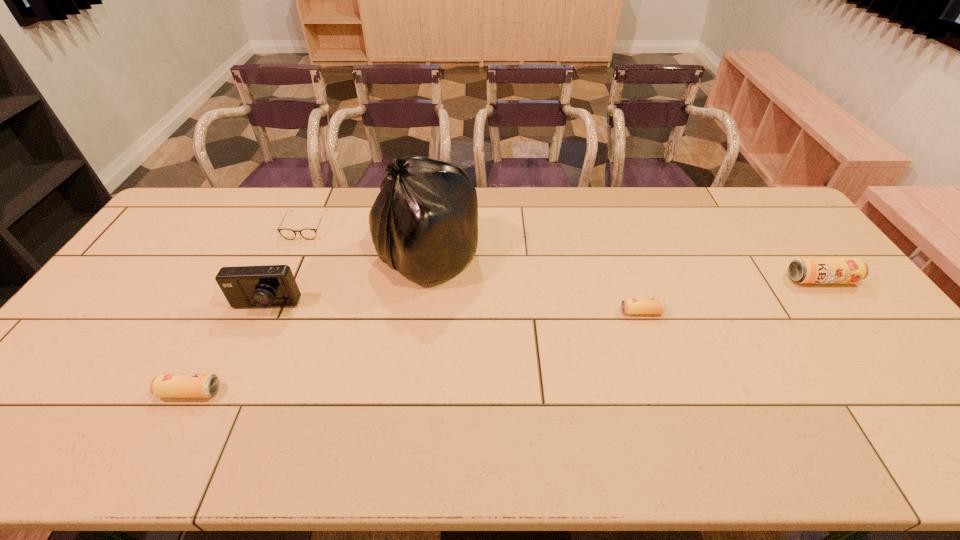
Locate an element on the screen. The width and height of the screenshot is (960, 540). free area in between the spectacles and the third tallest object is located at coordinates (564, 253).

At what (x,y) coordinates should I click in order to perform the action: click on empty location between the shortest beer can and the nearest beer can. Please return your answer as a coordinate pair (x, y). Image resolution: width=960 pixels, height=540 pixels. Looking at the image, I should click on (416, 352).

The image size is (960, 540). I want to click on object that can be found as the third closest to the rightmost beer can, so click(265, 286).

I want to click on object that stands as the second closest to the rightmost object, so click(x=424, y=222).

Select which beer can is the closest to the second nearest beer can. Please provide its 2D coordinates. Your answer should be formatted as a tuple, i.e. [(x, y)], where the tuple contains the x and y coordinates of a point satisfying the conditions above.

[(801, 270)]

Choose which beer can is the nearest neighbor to the second beer can from left to right. Please provide its 2D coordinates. Your answer should be formatted as a tuple, i.e. [(x, y)], where the tuple contains the x and y coordinates of a point satisfying the conditions above.

[(801, 270)]

Find the location of `blank area in the image that satisfies the following two spatial constraints: 1. through the lenses of the tallest object; 2. on the right side of the spectacles`. blank area in the image that satisfies the following two spatial constraints: 1. through the lenses of the tallest object; 2. on the right side of the spectacles is located at coordinates (x=293, y=255).

This screenshot has width=960, height=540. What are the coordinates of `vacant space that satisfies the following two spatial constraints: 1. through the lenses of the plastic bag; 2. on the right side of the spectacles` in the screenshot? It's located at (293, 255).

Locate an element on the screen. Image resolution: width=960 pixels, height=540 pixels. vacant area that satisfies the following two spatial constraints: 1. through the lenses of the rightmost beer can; 2. on the left side of the spectacles is located at coordinates coord(282,280).